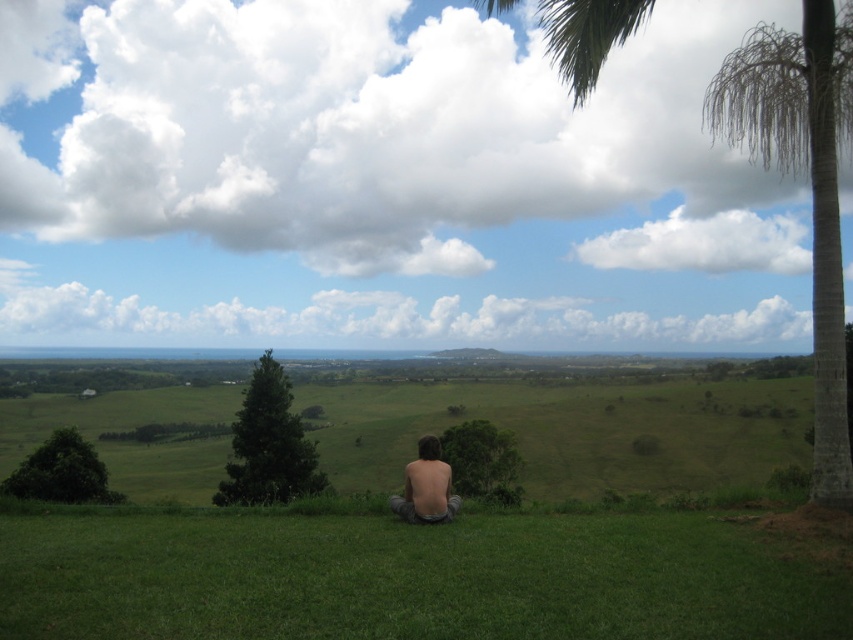
Question: Can you confirm if green matte tree at center is positioned to the left of green leafy tree at center?

Choices:
 (A) no
 (B) yes

Answer: (B)

Question: Estimate the real-world distances between objects in this image. Which object is closer to the nude human at center?

Choices:
 (A) green leafy tree at center
 (B) green matte tree at center

Answer: (A)

Question: Does green textured palm tree at right appear on the left side of green leafy tree at center?

Choices:
 (A) no
 (B) yes

Answer: (A)

Question: Does green leafy tree at lower left have a lesser width compared to nude human at center?

Choices:
 (A) no
 (B) yes

Answer: (A)

Question: Which of the following is the closest to the observer?

Choices:
 (A) green leafy tree at center
 (B) green textured palm tree at right

Answer: (B)

Question: Which of these objects is positioned farthest from the green leafy tree at lower left?

Choices:
 (A) green grassy at center
 (B) shiny brown hair at center
 (C) green textured palm tree at right

Answer: (C)